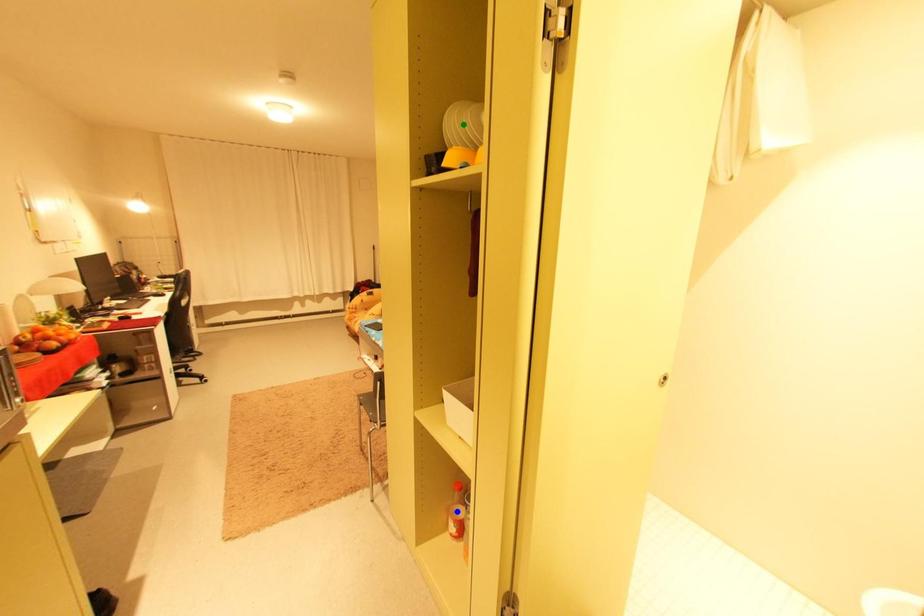
Order these from farthest to nearest:
- blue point
- green point
- orange point

blue point < green point < orange point